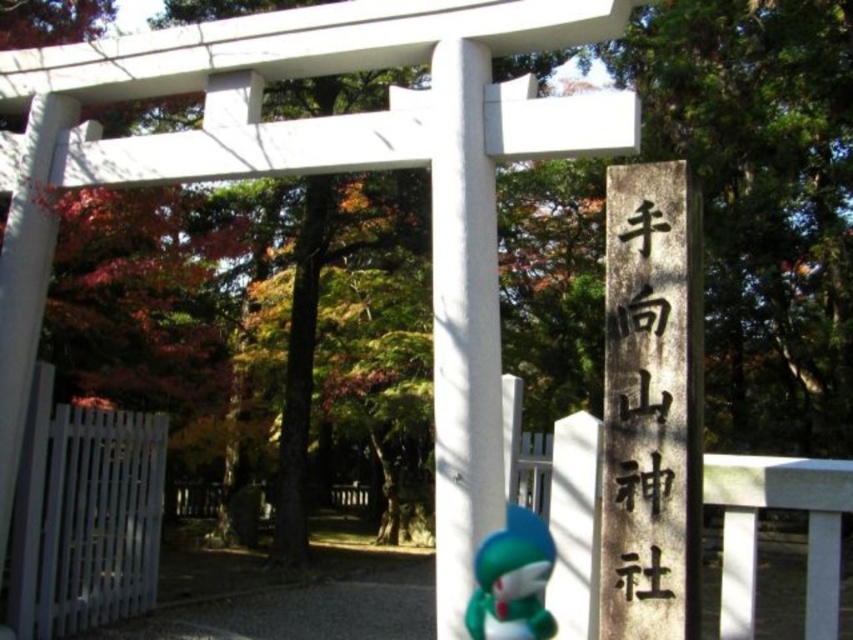
Identify the location of black stone sign at right. The height and width of the screenshot is (640, 853). (645, 397).

I want to click on black stone sign at right, so click(x=645, y=397).